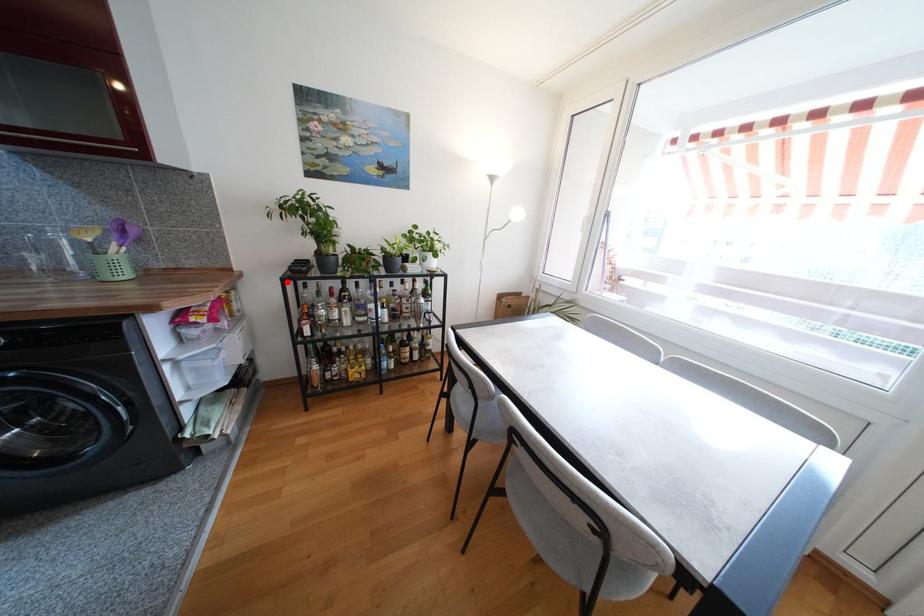
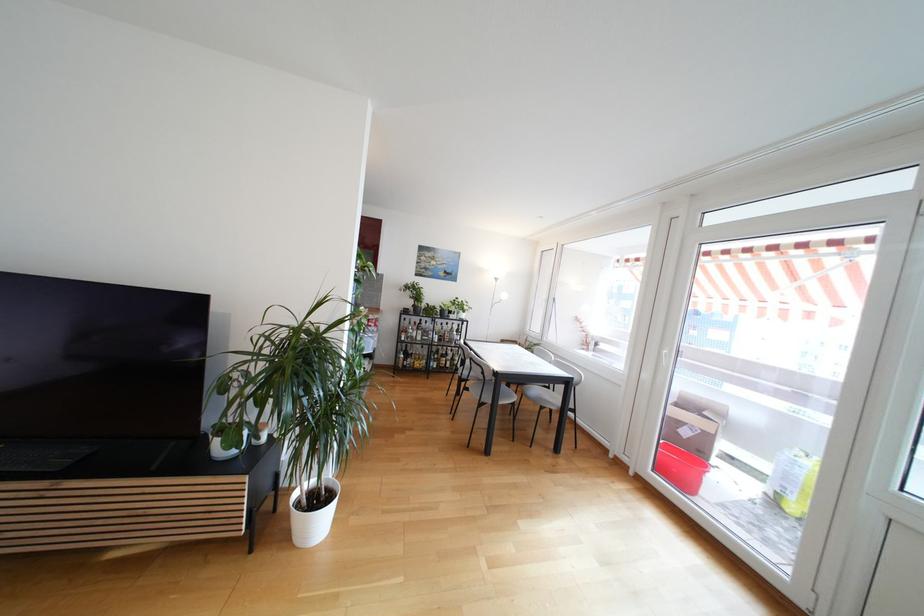
Question: I am providing you with two images of the same scene from different viewpoints. A red point is shown in image1. For the corresponding object point in image2, is it positioned nearer or farther from the camera?

Choices:
 (A) Nearer
 (B) Farther

Answer: (B)